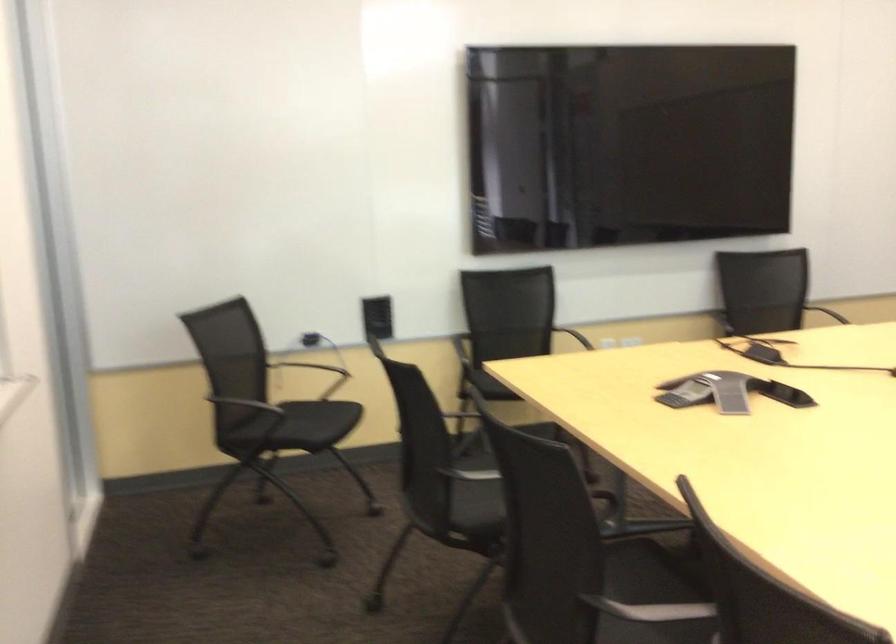
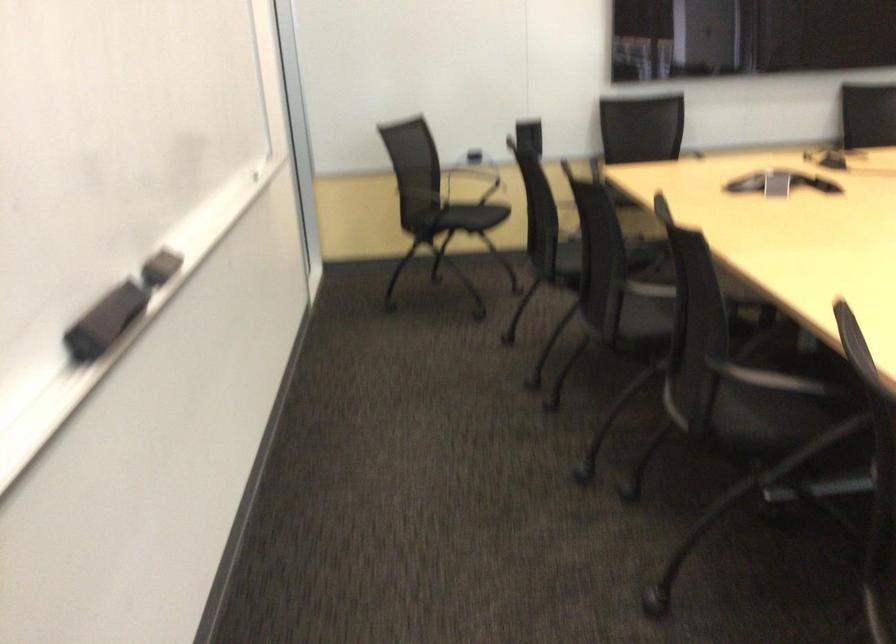
In the second image, find the point that corresponds to (x=270, y=429) in the first image.

(448, 216)